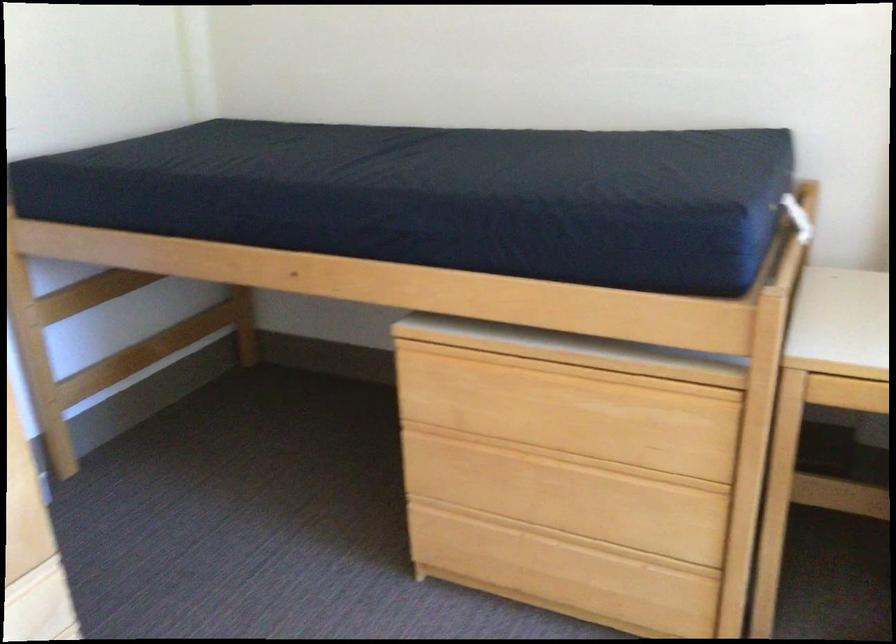
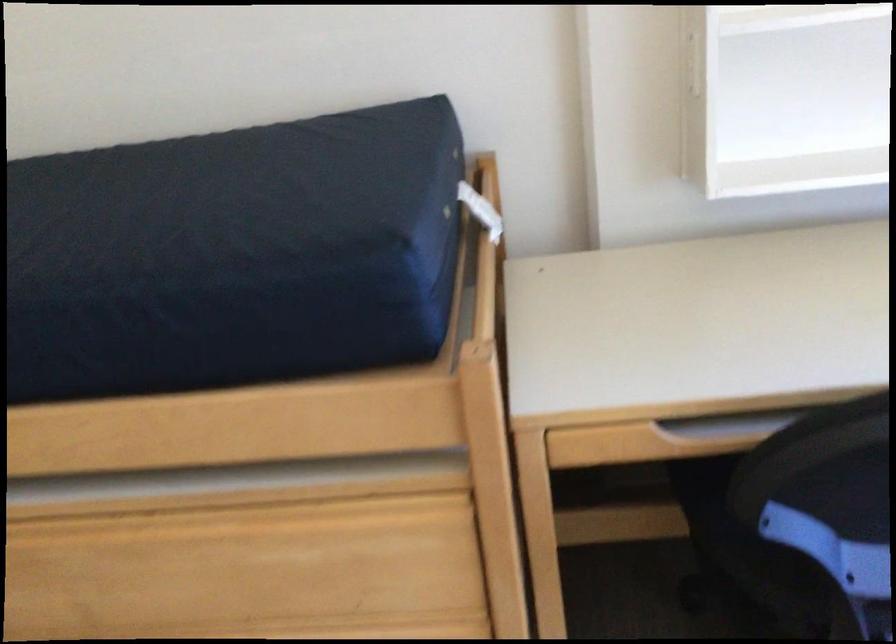
Locate, in the second image, the point that corresponds to (625,182) in the first image.

(243, 221)